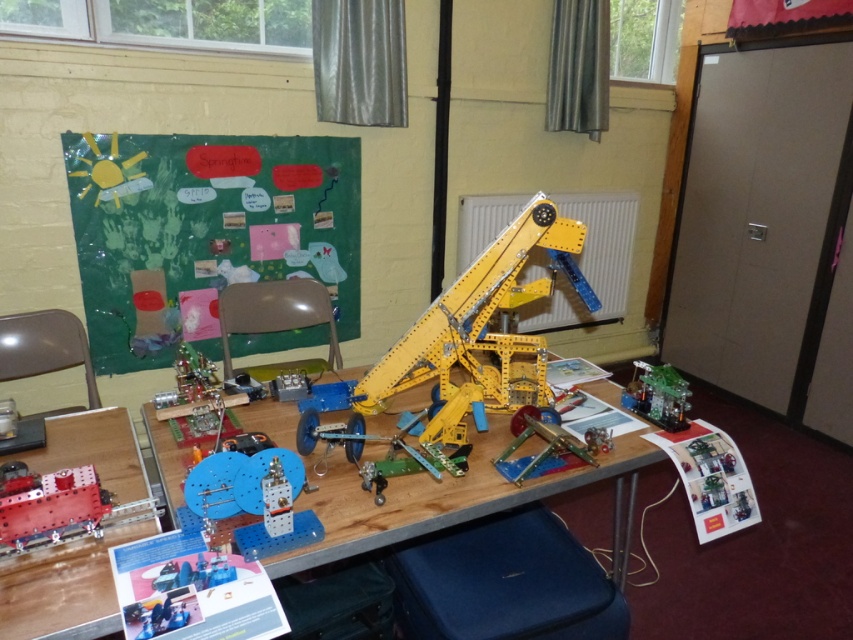
Is green paperboard at upper left positioned in front of metallic red cannon at lower left?

No, it is not.

Which is more to the left, green paperboard at upper left or metallic red cannon at lower left?

Positioned to the left is green paperboard at upper left.

Which is in front, point (85, 192) or point (68, 480)?

Point (68, 480)

Where is `green paperboard at upper left`? The height and width of the screenshot is (640, 853). green paperboard at upper left is located at coordinates (204, 232).

Is metallic red cannon at lower left below metallic yellow crane at center?

Correct, metallic red cannon at lower left is located below metallic yellow crane at center.

Between point (38, 513) and point (514, 428), which one is positioned in front?

Point (38, 513) is more forward.

What do you see at coordinates (51, 506) in the screenshot? This screenshot has height=640, width=853. I see `metallic red cannon at lower left` at bounding box center [51, 506].

Find the location of `metallic red cannon at lower left`. metallic red cannon at lower left is located at coordinates (51, 506).

Image resolution: width=853 pixels, height=640 pixels. Describe the element at coordinates (434, 497) in the screenshot. I see `yellow plastic table at center` at that location.

In the scene shown: Does yellow plastic table at center appear under green plastic toy at lower right?

Correct, yellow plastic table at center is located below green plastic toy at lower right.

Is point (18, 632) positioned before point (624, 390)?

Yes, it is.

The width and height of the screenshot is (853, 640). I want to click on yellow plastic table at center, so click(x=434, y=497).